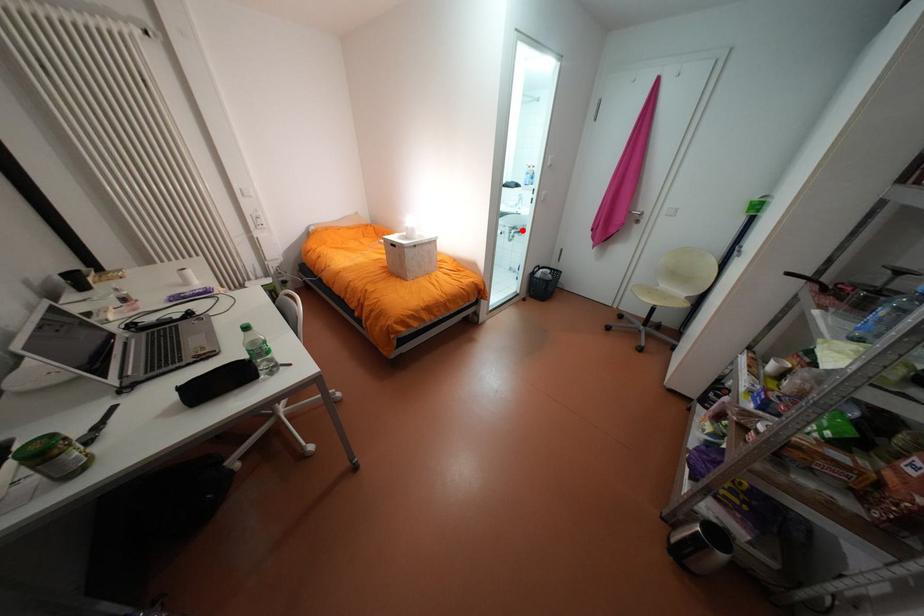
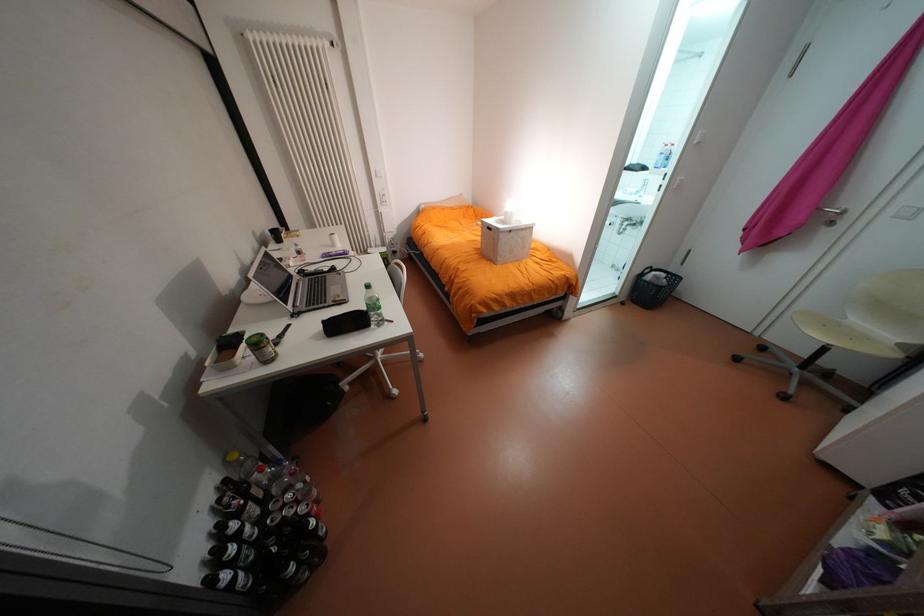
Question: A red point is marked in image1. In image2, is the corresponding 3D point closer to the camera or farther? Reply with the corresponding letter.

Choices:
 (A) The corresponding 3D point is closer.
 (B) The corresponding 3D point is farther.

Answer: (B)